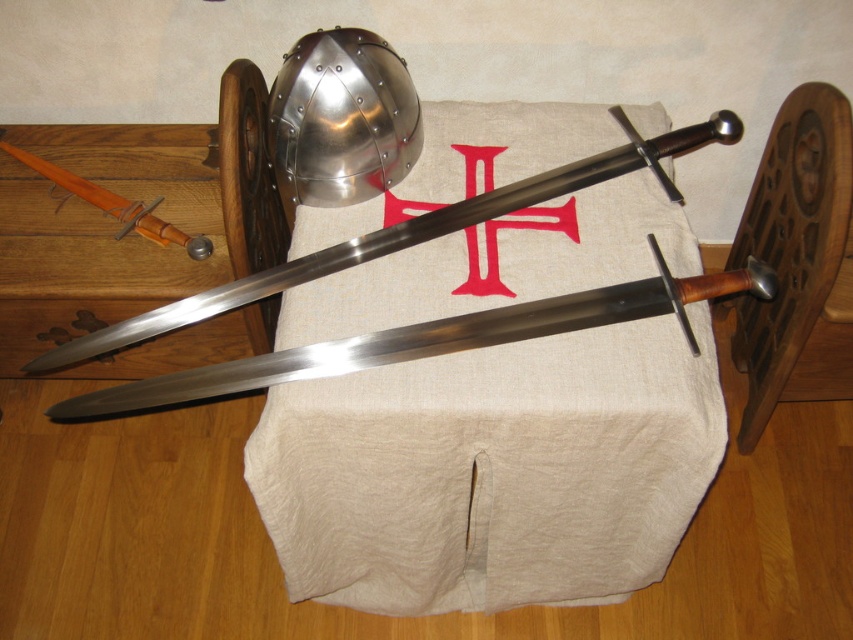
You are standing in front of a medieval weapon display. There is a point marked at coordinates (485, 342). Can you determine if this point is closer to you than 1 meter?

The distance of point (485, 342) from the viewer is 93.53 centimeters, which is less than 1 meter. Therefore, the point is closer to you than 1 meter.

Where is the polished metal sword at center located in the image?

The polished metal sword at center is located at point (433,339) in the image.

You are a medieval knight standing in front of the display. You need to place a new shield on the beige linen tablecloth at center. Where exactly should you place it?

Place the shield at the coordinates point (492,472) on the beige linen tablecloth at center as specified.